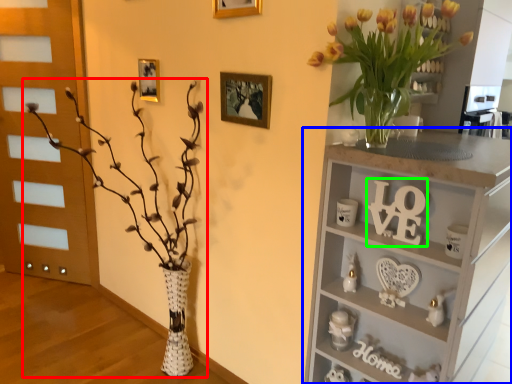
Question: Which is farther away from houseplant (highlighted by a red box)? shelf (highlighted by a blue box) or number (highlighted by a green box)?

Choices:
 (A) shelf
 (B) number

Answer: (B)